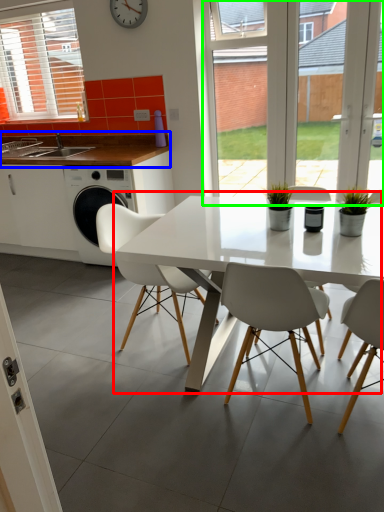
Question: Which is nearer to the kitchen & dining room table (highlighted by a red box)? countertop (highlighted by a blue box) or glass door (highlighted by a green box).

Choices:
 (A) countertop
 (B) glass door

Answer: (A)